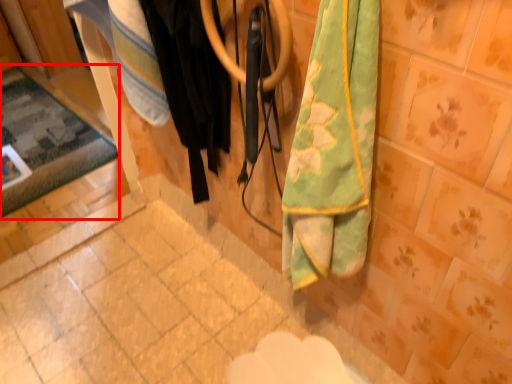
Question: From the image, what is the correct spatial relationship of mat (annotated by the red box) in relation to clothing?

Choices:
 (A) left
 (B) right

Answer: (A)